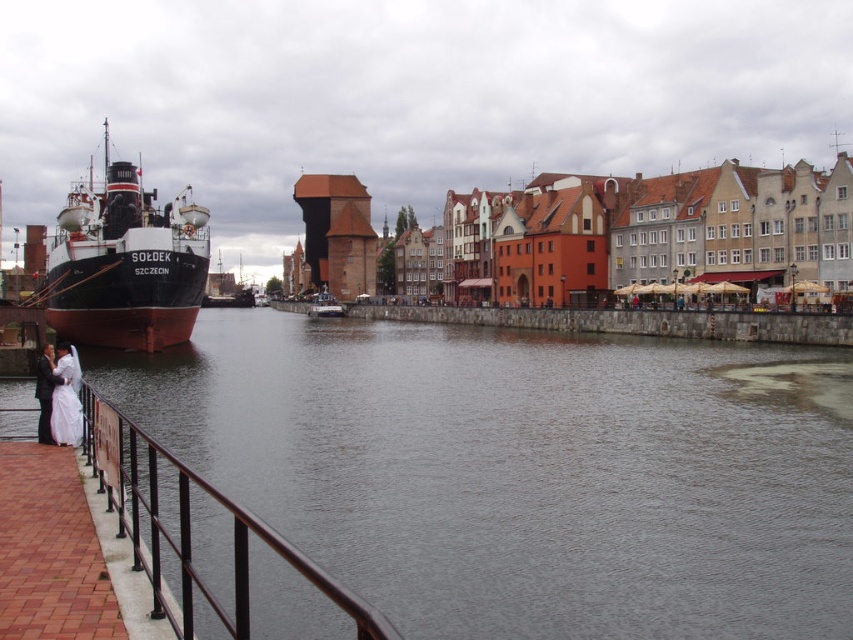
Does white satin dress at lower left appear over metallic gray boat at center?

No, white satin dress at lower left is not above metallic gray boat at center.

Is point (57, 353) less distant than point (321, 301)?

Yes, point (57, 353) is closer to viewer.

Image resolution: width=853 pixels, height=640 pixels. Describe the element at coordinates (57, 396) in the screenshot. I see `white satin dress at lower left` at that location.

Identify the location of white satin dress at lower left. (57, 396).

Which is above, dark gray water at lower center or black metal railing at lower left?

dark gray water at lower center is higher up.

Is point (424, 433) more distant than point (300, 593)?

Yes, it is behind point (300, 593).

Between point (349, 572) and point (138, 435), which one is positioned in front?

Point (138, 435) is more forward.

Where is `dark gray water at lower center`? dark gray water at lower center is located at coordinates (519, 472).

Which of these two, black metal railing at lower left or metallic gray boat at center, stands taller?

black metal railing at lower left is taller.

Can you confirm if black metal railing at lower left is taller than metallic gray boat at center?

Correct, black metal railing at lower left is much taller as metallic gray boat at center.

Does point (219, 518) lie in front of point (325, 292)?

Yes, point (219, 518) is in front of point (325, 292).

The width and height of the screenshot is (853, 640). What are the coordinates of `black metal railing at lower left` in the screenshot? It's located at (202, 538).